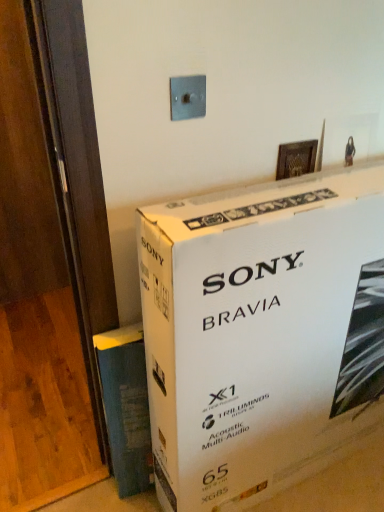
Question: Is point (102, 376) positioned closer to the camera than point (23, 429)?

Choices:
 (A) farther
 (B) closer

Answer: (B)

Question: Considering the positions of blue textured paper at lower left and wooden at left in the image, is blue textured paper at lower left bigger or smaller than wooden at left?

Choices:
 (A) small
 (B) big

Answer: (A)

Question: Which object is the farthest from the wooden at left?

Choices:
 (A) metallic gray switch at upper center
 (B) white cardboard box at upper center
 (C) blue textured paper at lower left

Answer: (A)

Question: Which of these objects is positioned farthest from the blue textured paper at lower left?

Choices:
 (A) metallic gray switch at upper center
 (B) white cardboard box at upper center
 (C) wooden at left

Answer: (A)